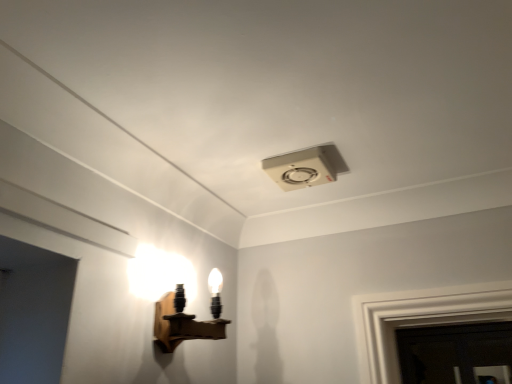
Question: Is dark glass door at lower right not near wooden wall sconce at left, which appears as the 2th lamp when viewed from the top?

Choices:
 (A) no
 (B) yes

Answer: (B)

Question: Is wooden wall sconce at left, the 1th lamp when ordered from bottom to top, completely or partially inside dark glass door at lower right?

Choices:
 (A) yes
 (B) no

Answer: (B)

Question: Is dark glass door at lower right with wooden wall sconce at left, which is the 1th lamp from left to right?

Choices:
 (A) no
 (B) yes

Answer: (A)

Question: Considering the relative sizes of dark glass door at lower right and wooden wall sconce at left, the second lamp viewed from the right, in the image provided, is dark glass door at lower right thinner than wooden wall sconce at left, the second lamp viewed from the right,?

Choices:
 (A) no
 (B) yes

Answer: (B)

Question: From a real-world perspective, is dark glass door at lower right below wooden wall sconce at left, which is the 1th lamp from left to right?

Choices:
 (A) yes
 (B) no

Answer: (B)

Question: In terms of width, does dark glass door at lower right look wider or thinner when compared to wooden wall sconce at left, the second lamp viewed from the right?

Choices:
 (A) thin
 (B) wide

Answer: (A)

Question: In terms of size, does dark glass door at lower right appear bigger or smaller than wooden wall sconce at left, which appears as the 2th lamp when viewed from the top?

Choices:
 (A) big
 (B) small

Answer: (A)

Question: From the image's perspective, is dark glass door at lower right positioned above or below wooden wall sconce at left, the second lamp viewed from the right?

Choices:
 (A) below
 (B) above

Answer: (A)

Question: Is point (446, 339) closer or farther from the camera than point (166, 324)?

Choices:
 (A) farther
 (B) closer

Answer: (A)

Question: Is wooden wall sconce at left, which is the 1th lamp from left to right, wider or thinner than white plastic ceiling fan at upper center, which is the 2th lamp in left-to-right order?

Choices:
 (A) wide
 (B) thin

Answer: (B)

Question: Considering their positions, is wooden wall sconce at left, which appears as the 2th lamp when viewed from the top, located in front of or behind white plastic ceiling fan at upper center, which is the first lamp from top to bottom?

Choices:
 (A) front
 (B) behind

Answer: (A)

Question: From a real-world perspective, is wooden wall sconce at left, the 1th lamp when ordered from bottom to top, positioned above or below white plastic ceiling fan at upper center, which appears as the first lamp when viewed from the right?

Choices:
 (A) above
 (B) below

Answer: (B)

Question: Is wooden wall sconce at left, the second lamp viewed from the right, taller or shorter than white plastic ceiling fan at upper center, which appears as the first lamp when viewed from the right?

Choices:
 (A) short
 (B) tall

Answer: (B)

Question: Is point (345, 165) closer or farther from the camera than point (482, 370)?

Choices:
 (A) closer
 (B) farther

Answer: (A)

Question: Relative to dark glass door at lower right, is white plastic ceiling fan at upper center, which appears as the first lamp when viewed from the right, in front or behind?

Choices:
 (A) behind
 (B) front

Answer: (B)